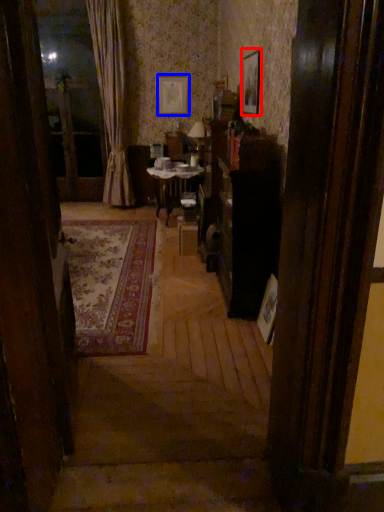
Question: Among these objects, which one is nearest to the camera, picture frame (highlighted by a red box) or picture frame (highlighted by a blue box)?

Choices:
 (A) picture frame
 (B) picture frame

Answer: (A)